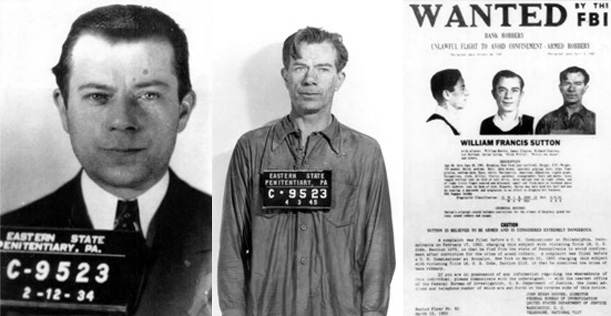
The width and height of the screenshot is (611, 316). What are the coordinates of `left ear on leftmost portrait` in the screenshot? It's located at (188, 106).